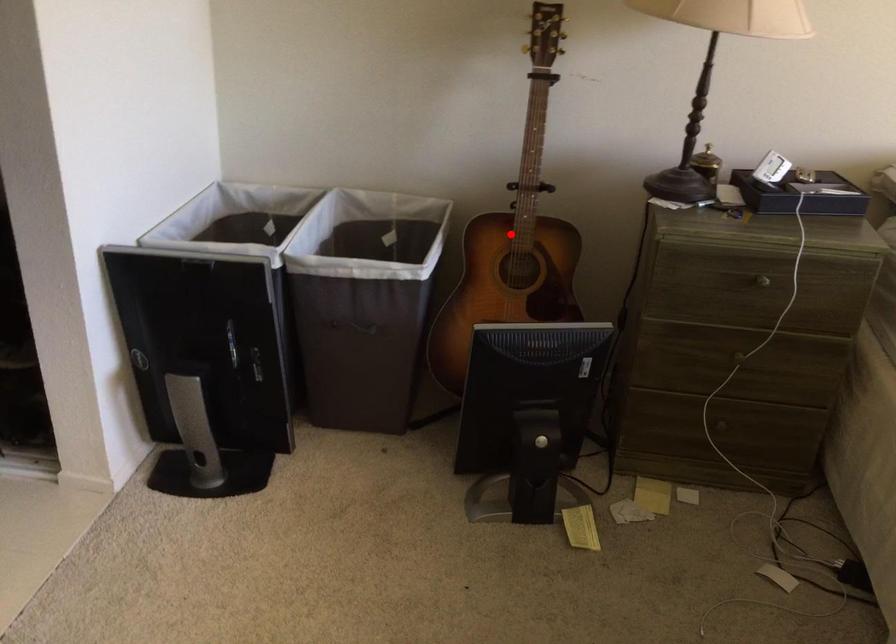
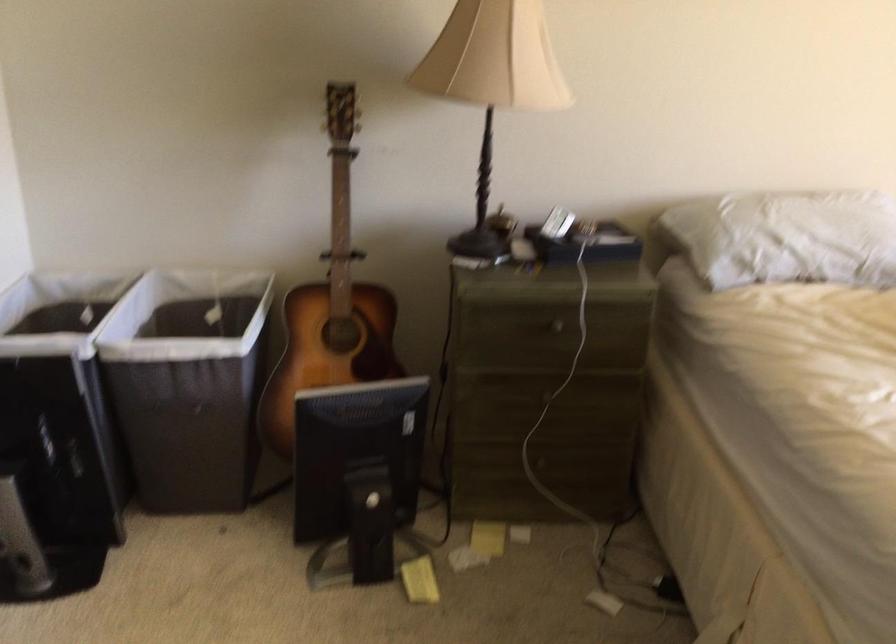
The point at the highlighted location is marked in the first image. Where is the corresponding point in the second image?

(331, 303)